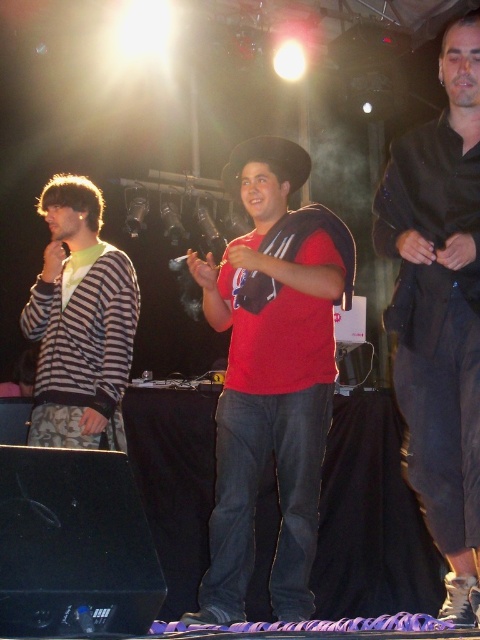
Question: Can you confirm if black satin suit at right is wider than striped knit cardigan at left?

Choices:
 (A) yes
 (B) no

Answer: (B)

Question: Among these points, which one is farthest from the camera?

Choices:
 (A) (302, 284)
 (B) (57, 371)
 (C) (448, 250)

Answer: (B)

Question: Which of the following is the farthest from the observer?

Choices:
 (A) red matte shirt at center
 (B) striped knit cardigan at left
 (C) black satin suit at right

Answer: (B)

Question: Does black satin suit at right have a greater width compared to striped knit cardigan at left?

Choices:
 (A) no
 (B) yes

Answer: (A)

Question: Does black satin suit at right have a lesser width compared to striped knit cardigan at left?

Choices:
 (A) yes
 (B) no

Answer: (A)

Question: Which point appears farthest from the camera in this image?

Choices:
 (A) (73, 333)
 (B) (241, 545)
 (C) (434, 280)

Answer: (A)